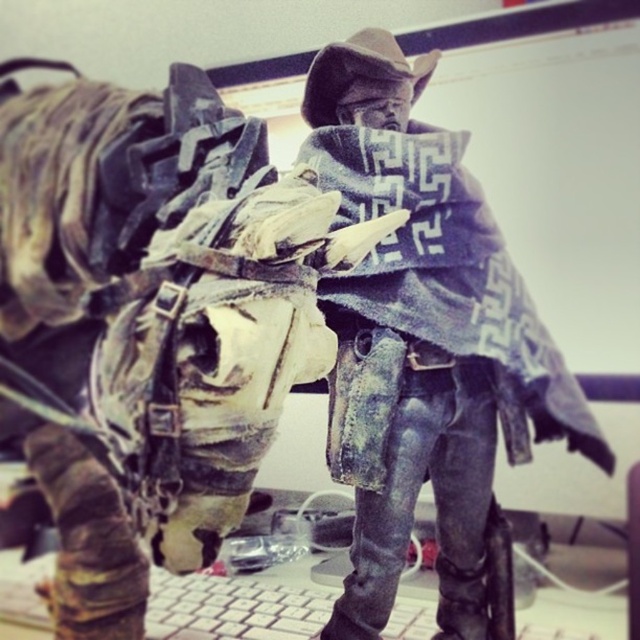
Question: Observing the image, what is the correct spatial positioning of worn leather jacket at center in reference to worn denim jacket at center?

Choices:
 (A) below
 (B) above

Answer: (B)

Question: Which point is closer to the camera?

Choices:
 (A) (384, 529)
 (B) (22, 296)

Answer: (B)

Question: Does worn leather jacket at center lie in front of worn denim jacket at center?

Choices:
 (A) no
 (B) yes

Answer: (B)

Question: Which object is closer to the camera taking this photo?

Choices:
 (A) worn leather jacket at center
 (B) worn denim jacket at center

Answer: (A)

Question: Which point appears farthest from the camera in this image?

Choices:
 (A) (492, 273)
 (B) (214, 340)

Answer: (A)

Question: Does worn leather jacket at center appear on the right side of worn denim jacket at center?

Choices:
 (A) yes
 (B) no

Answer: (B)